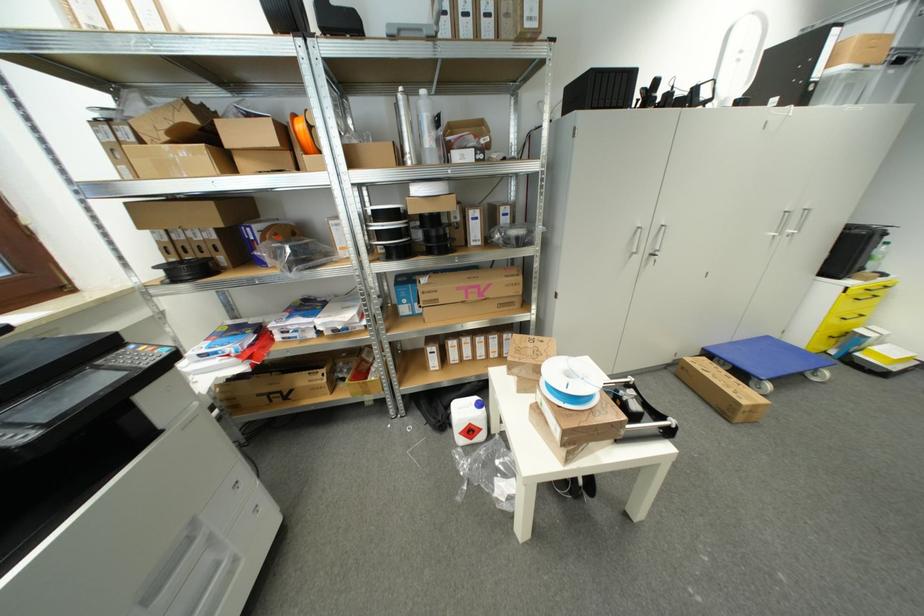
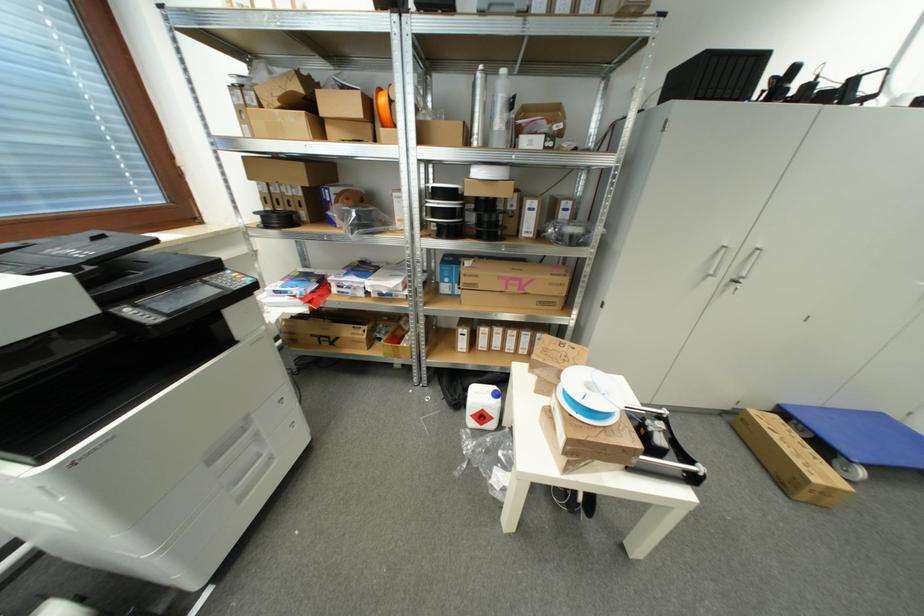
In the second image, find the point that corresponds to pixel 443 238 in the first image.

(493, 225)